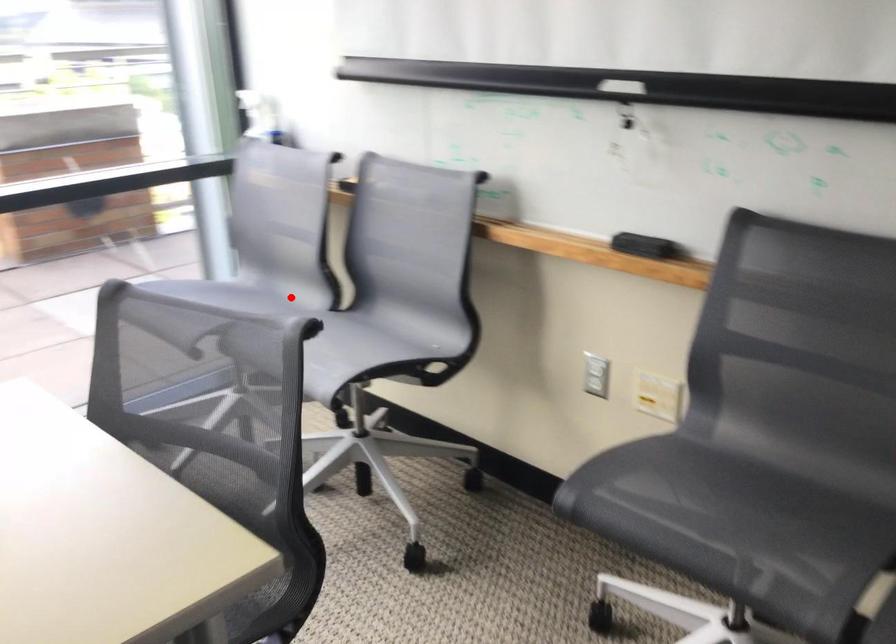
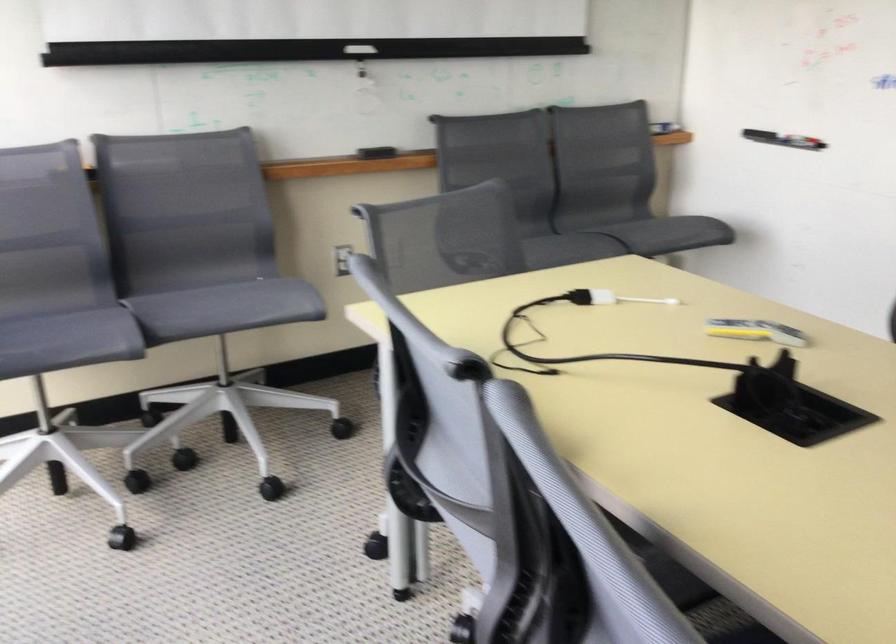
Question: I am providing you with two images of the same scene from different viewpoints. A red point is shown in image1. For the corresponding object point in image2, is it positioned nearer or farther from the camera?

Choices:
 (A) Nearer
 (B) Farther

Answer: (A)